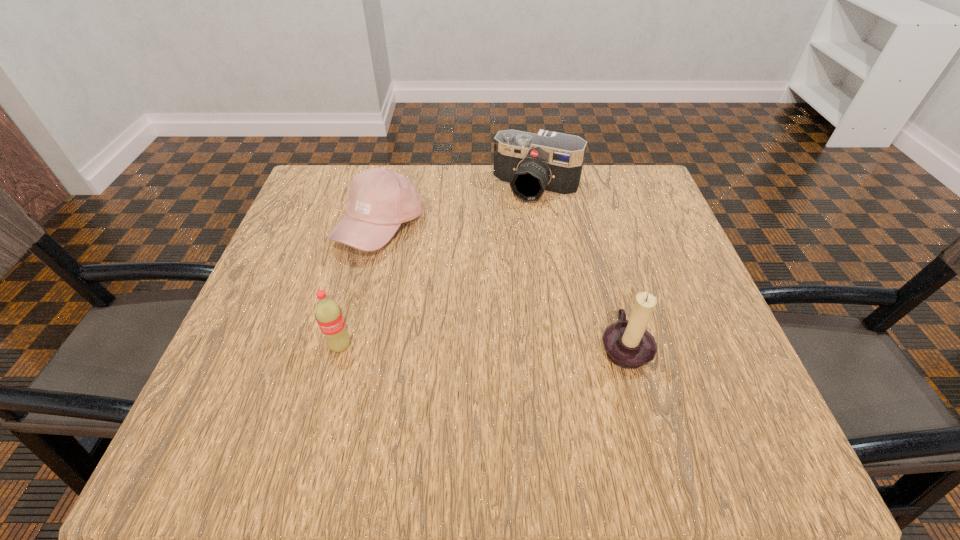
At what (x,y) coordinates should I click in order to perform the action: click on soda. Please return your answer as a coordinate pair (x, y). Looking at the image, I should click on (328, 314).

I want to click on candle holder, so click(x=628, y=344).

Locate an element on the screen. This screenshot has height=540, width=960. baseball cap is located at coordinates (380, 199).

The height and width of the screenshot is (540, 960). In order to click on camera in this screenshot , I will do `click(549, 162)`.

In order to click on free region located 0.280m on the back of the soda in this screenshot , I will do `click(370, 238)`.

This screenshot has height=540, width=960. Find the location of `vacant region located on the wick of the candle holder`. vacant region located on the wick of the candle holder is located at coordinates (709, 346).

Find the location of `vacant space located on the front-facing side of the baseball cap`. vacant space located on the front-facing side of the baseball cap is located at coordinates (457, 346).

The height and width of the screenshot is (540, 960). I want to click on free space located 0.140m on the front-facing side of the baseball cap, so click(425, 300).

Find the location of a particular element. Image resolution: width=960 pixels, height=540 pixels. free location located 0.380m on the front-facing side of the baseball cap is located at coordinates (490, 392).

You are a GUI agent. You are given a task and a screenshot of the screen. Output one action in this format:
    pyautogui.click(x=<x>, y=<y>)
    Task: Click on the vacant space situated 0.330m on the front-facing side of the camera
    The width and height of the screenshot is (960, 540).
    Given the screenshot: What is the action you would take?
    pyautogui.click(x=474, y=300)